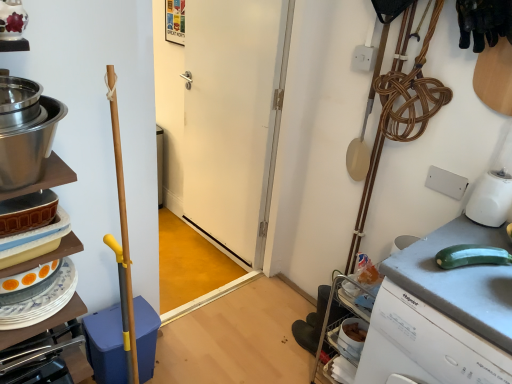
Question: Should I look upward or downward to see stainless steel bowl at left?

Choices:
 (A) up
 (B) down

Answer: (A)

Question: Is gray matte countertop at right next to blue plastic dish washer at left and touching it?

Choices:
 (A) yes
 (B) no

Answer: (B)

Question: Can you confirm if gray matte countertop at right is positioned to the left of blue plastic dish washer at left?

Choices:
 (A) no
 (B) yes

Answer: (A)

Question: Is gray matte countertop at right oriented towards blue plastic dish washer at left?

Choices:
 (A) no
 (B) yes

Answer: (A)

Question: From the image's perspective, is gray matte countertop at right below blue plastic dish washer at left?

Choices:
 (A) yes
 (B) no

Answer: (B)

Question: Does gray matte countertop at right have a lesser height compared to blue plastic dish washer at left?

Choices:
 (A) no
 (B) yes

Answer: (A)

Question: Considering the relative positions of gray matte countertop at right and blue plastic dish washer at left in the image provided, is gray matte countertop at right behind blue plastic dish washer at left?

Choices:
 (A) no
 (B) yes

Answer: (A)

Question: From a real-world perspective, is matte ceramic dishes at left physically above stainless steel bowl at left?

Choices:
 (A) yes
 (B) no

Answer: (B)

Question: Is matte ceramic dishes at left facing away from stainless steel bowl at left?

Choices:
 (A) yes
 (B) no

Answer: (B)

Question: Can you confirm if matte ceramic dishes at left is positioned to the left of stainless steel bowl at left?

Choices:
 (A) no
 (B) yes

Answer: (B)

Question: Does matte ceramic dishes at left turn towards stainless steel bowl at left?

Choices:
 (A) yes
 (B) no

Answer: (B)

Question: Could stainless steel bowl at left be considered to be inside matte ceramic dishes at left?

Choices:
 (A) no
 (B) yes

Answer: (A)

Question: Is matte ceramic dishes at left at the right side of stainless steel bowl at left?

Choices:
 (A) yes
 (B) no

Answer: (B)

Question: Can you see stainless steel bowl at left touching white matte door at center?

Choices:
 (A) no
 (B) yes

Answer: (A)